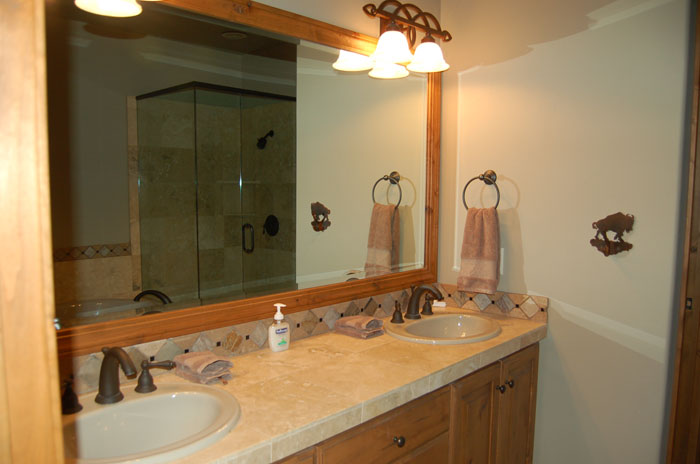
You are a GUI agent. You are given a task and a screenshot of the screen. Output one action in this format:
    pyautogui.click(x=<x>, y=<y>)
    Task: Click on the sink
    Image resolution: width=700 pixels, height=464 pixels.
    Given the screenshot: What is the action you would take?
    click(449, 319), click(172, 419)